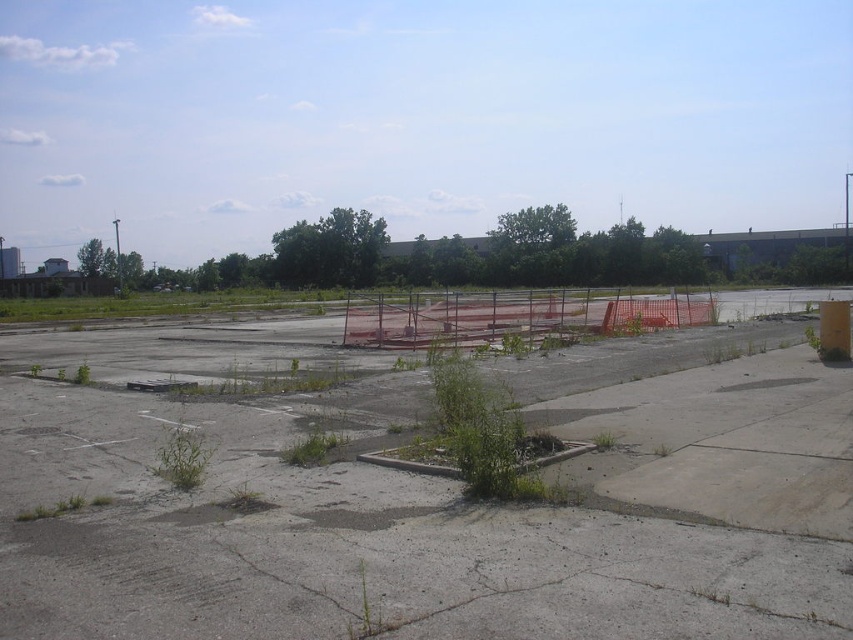
Question: Can you confirm if gray concrete pavement at center is positioned to the left of orange mesh fence at center?

Choices:
 (A) yes
 (B) no

Answer: (A)

Question: Does gray concrete pavement at center have a smaller size compared to green leafy plant at center?

Choices:
 (A) no
 (B) yes

Answer: (A)

Question: Among these points, which one is nearest to the camera?

Choices:
 (A) (x=460, y=406)
 (B) (x=602, y=316)
 (C) (x=172, y=460)

Answer: (C)

Question: Is gray concrete pavement at center below green grassy weed at lower left?

Choices:
 (A) yes
 (B) no

Answer: (B)

Question: Which of the following is the closest to the observer?

Choices:
 (A) green leafy plant at center
 (B) gray concrete pavement at center
 (C) orange mesh fence at center
 (D) green grassy weed at lower left

Answer: (B)

Question: Considering the real-world distances, which object is closest to the green grassy weed at lower left?

Choices:
 (A) gray concrete pavement at center
 (B) green leafy plant at center
 (C) orange mesh fence at center

Answer: (B)